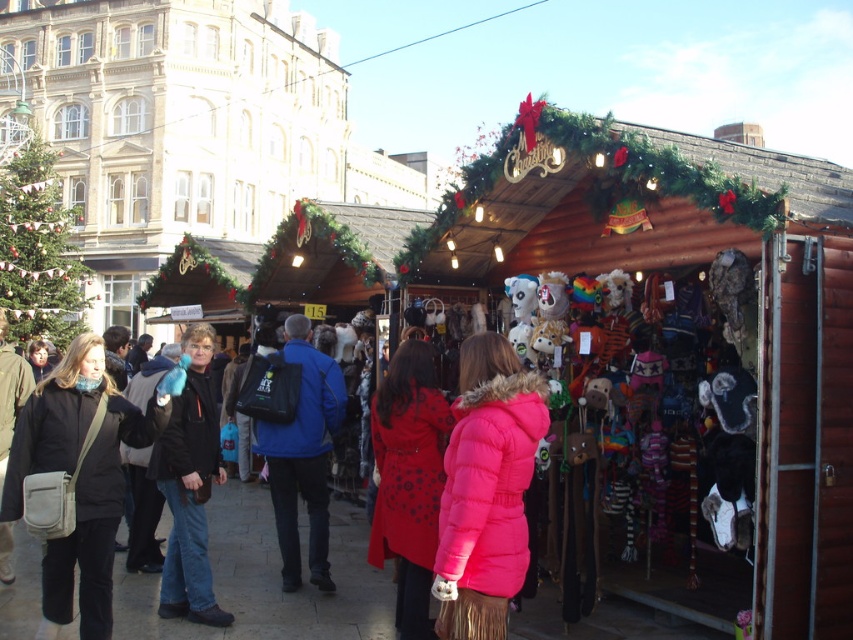
Question: Among these points, which one is nearest to the camera?

Choices:
 (A) (51, 396)
 (B) (410, 364)

Answer: (A)

Question: Is red fuzzy coat at center to the right of black fabric jacket at center from the viewer's perspective?

Choices:
 (A) yes
 (B) no

Answer: (A)

Question: Which point is farther to the camera?

Choices:
 (A) red fuzzy coat at center
 (B) pink puffy coat at center
 (C) blue matte jacket at center
 (D) black fabric jacket at center

Answer: (C)

Question: Can you confirm if matte black jacket at center is bigger than matte black jacket at left?

Choices:
 (A) yes
 (B) no

Answer: (B)

Question: Is matte black jacket at center above blue matte jacket at center?

Choices:
 (A) yes
 (B) no

Answer: (A)

Question: Which point appears closest to the camera in this image?

Choices:
 (A) (334, 380)
 (B) (492, 490)
 (C) (1, 310)

Answer: (B)